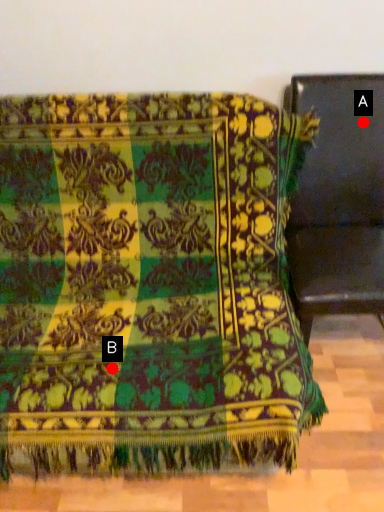
Question: Two points are circled on the image, labeled by A and B beside each circle. Which point is closer to the camera?

Choices:
 (A) A is closer
 (B) B is closer

Answer: (B)